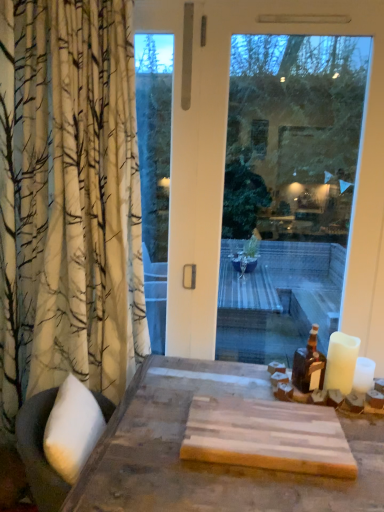
What do you see at coordinates (309, 365) in the screenshot? The width and height of the screenshot is (384, 512). I see `brown glass bottle at right` at bounding box center [309, 365].

Image resolution: width=384 pixels, height=512 pixels. What are the coordinates of `brown glass bottle at right` in the screenshot? It's located at (309, 365).

Which is in front, brown glass bottle at right or white matte candle at right?

white matte candle at right is more forward.

Identify the location of bottle above the white matte candle at right (from the image's perspective). Image resolution: width=384 pixels, height=512 pixels. (309, 365).

Does brown glass bottle at right turn towards white matte candle at right?

No, brown glass bottle at right is not oriented towards white matte candle at right.

Considering the relative sizes of transparent glass window at center and white matte candle at right in the image provided, is transparent glass window at center shorter than white matte candle at right?

No.

Consider the image. Considering the sizes of objects transparent glass window at center and white matte candle at right in the image provided, who is wider, transparent glass window at center or white matte candle at right?

With larger width is white matte candle at right.

Would you say transparent glass window at center is to the left or to the right of white matte candle at right in the picture?

Clearly, transparent glass window at center is on the left of white matte candle at right in the image.

Which object is positioned more to the right, white matte candle at right or brown glass bottle at right?

white matte candle at right.

Considering the sizes of objects white matte candle at right and brown glass bottle at right in the image provided, who is thinner, white matte candle at right or brown glass bottle at right?

white matte candle at right is thinner.

Could you tell me if white matte candle at right is facing brown glass bottle at right?

No, white matte candle at right does not turn towards brown glass bottle at right.

Which point is more forward, (351, 382) or (304, 354)?

The point (351, 382) is closer to the camera.

From a real-world perspective, is white matte candle at right physically located above or below transparent glass window at center?

white matte candle at right is situated lower than transparent glass window at center in the real world.

Are white matte candle at right and transparent glass window at center far apart?

No, white matte candle at right is in close proximity to transparent glass window at center.

Which is more to the right, white matte candle at right or transparent glass window at center?

Positioned to the right is white matte candle at right.

Is white matte candle at right positioned behind transparent glass window at center?

That is False.

Which is correct: transparent glass window at center is inside brown glass bottle at right, or outside of it?

The correct answer is: outside.

Are transparent glass window at center and brown glass bottle at right located far from each other?

No, transparent glass window at center is not far from brown glass bottle at right.

Is transparent glass window at center looking in the opposite direction of brown glass bottle at right?

That's right, transparent glass window at center is facing away from brown glass bottle at right.

Is point (201, 154) less distant than point (304, 356)?

Yes, it is in front of point (304, 356).

Consider the image. From a real-world perspective, is brown glass bottle at right below transparent glass window at center?

Yes, from a real-world perspective, brown glass bottle at right is beneath transparent glass window at center.

This screenshot has width=384, height=512. Identify the location of bottle in front of the transparent glass window at center. (309, 365).

Is brown glass bottle at right facing away from transparent glass window at center?

Yes.

Are brown glass bottle at right and transparent glass window at center located far from each other?

Actually, brown glass bottle at right and transparent glass window at center are a little close together.

Locate an element on the screen. bottle on the left of white matte candle at right is located at coordinates point(309,365).

The width and height of the screenshot is (384, 512). There is a white matte candle at right. What are the coordinates of `window above it (from a real-world perspective)` in the screenshot? It's located at (224, 162).

From the image, which object appears to be nearer to brown glass bottle at right, white matte candle at right or transparent glass window at center?

white matte candle at right.

Considering their positions, is transparent glass window at center positioned closer to white matte candle at right than brown glass bottle at right?

brown glass bottle at right lies closer to white matte candle at right than the other object.

Estimate the real-world distances between objects in this image. Which object is closer to white matte candle at right, brown glass bottle at right or transparent glass window at center?

Based on the image, brown glass bottle at right appears to be nearer to white matte candle at right.

Estimate the real-world distances between objects in this image. Which object is closer to brown glass bottle at right, transparent glass window at center or white matte candle at right?

The object closer to brown glass bottle at right is white matte candle at right.

Which object lies nearer to the anchor point transparent glass window at center, white matte candle at right or brown glass bottle at right?

Based on the image, white matte candle at right appears to be nearer to transparent glass window at center.

Which object lies nearer to the anchor point transparent glass window at center, brown glass bottle at right or white matte candle at right?

white matte candle at right.

You are a GUI agent. You are given a task and a screenshot of the screen. Output one action in this format:
    pyautogui.click(x=<x>, y=<y>)
    Task: Click on the bottle between transparent glass window at center and white matte candle at right in the up-down direction
    
    Given the screenshot: What is the action you would take?
    pyautogui.click(x=309, y=365)